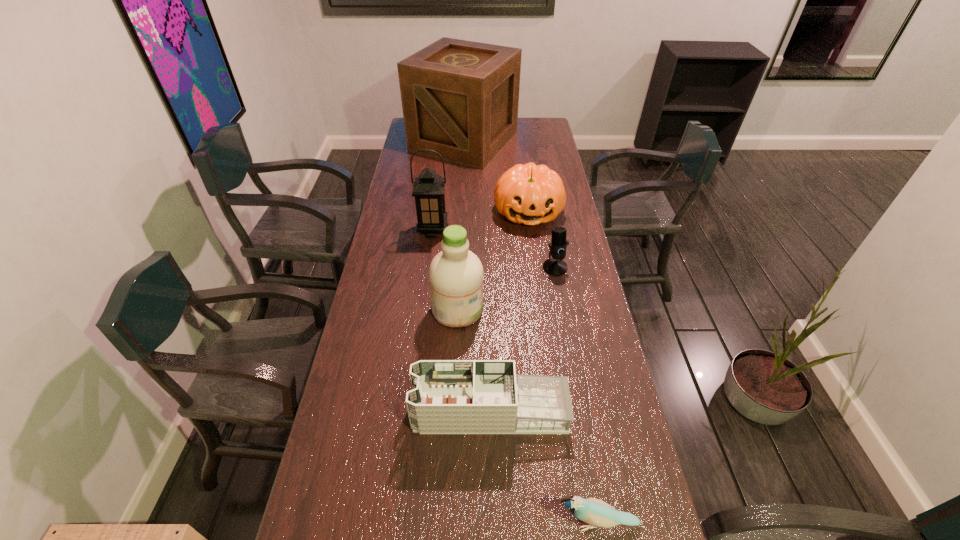
The height and width of the screenshot is (540, 960). I want to click on the tallest object, so click(460, 98).

The image size is (960, 540). What are the coordinates of `the farthest object` in the screenshot? It's located at (460, 98).

Identify the location of lantern. (428, 190).

Where is `cleansing agent`? This screenshot has height=540, width=960. cleansing agent is located at coordinates (456, 274).

Identify the location of pumpkin. The height and width of the screenshot is (540, 960). (529, 194).

Where is `microphone`? microphone is located at coordinates (555, 266).

This screenshot has height=540, width=960. What are the coordinates of `dollhouse` in the screenshot? It's located at (448, 396).

I want to click on the nearest object, so click(x=595, y=512).

Where is `free space located 0.170m on the right of the box`? This screenshot has width=960, height=540. free space located 0.170m on the right of the box is located at coordinates (551, 141).

Locate an element on the screen. Image resolution: width=960 pixels, height=540 pixels. vacant space located 0.280m on the right of the lantern is located at coordinates (519, 230).